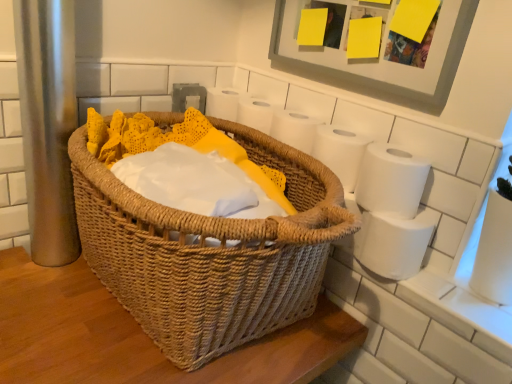
Question: From a real-world perspective, does white matte toilet paper at right, placed as the first toilet paper when sorted from bottom to top, sit lower than white matte toilet paper at upper right, acting as the third toilet paper starting from the bottom?

Choices:
 (A) yes
 (B) no

Answer: (A)

Question: Considering the relative sizes of white matte toilet paper at right, placed as the first toilet paper when sorted from bottom to top, and white matte toilet paper at upper right, acting as the third toilet paper starting from the bottom, in the image provided, is white matte toilet paper at right, placed as the first toilet paper when sorted from bottom to top, wider than white matte toilet paper at upper right, acting as the third toilet paper starting from the bottom,?

Choices:
 (A) no
 (B) yes

Answer: (B)

Question: Can you confirm if white matte toilet paper at right, which is counted as the third toilet paper, starting from the top, is positioned to the left of white matte toilet paper at upper right, arranged as the first toilet paper when viewed from the top?

Choices:
 (A) no
 (B) yes

Answer: (A)

Question: Are white matte toilet paper at right, which is counted as the third toilet paper, starting from the top, and white matte toilet paper at upper right, acting as the third toilet paper starting from the bottom, far apart?

Choices:
 (A) no
 (B) yes

Answer: (A)

Question: Is white matte toilet paper at right, which is counted as the third toilet paper, starting from the top, looking in the opposite direction of white matte toilet paper at upper right, acting as the third toilet paper starting from the bottom?

Choices:
 (A) yes
 (B) no

Answer: (B)

Question: Is white matte toilet paper at right, which is counted as the third toilet paper, starting from the top, in contact with white matte toilet paper at upper right, acting as the third toilet paper starting from the bottom?

Choices:
 (A) yes
 (B) no

Answer: (B)

Question: Is matte gray picture frame at upper right not inside white matte toilet paper at upper right, arranged as the first toilet paper when viewed from the top?

Choices:
 (A) no
 (B) yes

Answer: (B)

Question: From the image's perspective, would you say matte gray picture frame at upper right is shown under white matte toilet paper at upper right, arranged as the first toilet paper when viewed from the top?

Choices:
 (A) no
 (B) yes

Answer: (A)

Question: Is the position of matte gray picture frame at upper right less distant than that of white matte toilet paper at upper right, arranged as the first toilet paper when viewed from the top?

Choices:
 (A) yes
 (B) no

Answer: (A)

Question: Is matte gray picture frame at upper right far from white matte toilet paper at upper right, arranged as the first toilet paper when viewed from the top?

Choices:
 (A) yes
 (B) no

Answer: (B)

Question: From a real-world perspective, is matte gray picture frame at upper right over white matte toilet paper at upper right, acting as the third toilet paper starting from the bottom?

Choices:
 (A) no
 (B) yes

Answer: (B)

Question: Is matte gray picture frame at upper right to the left of white matte toilet paper at upper right, arranged as the first toilet paper when viewed from the top, from the viewer's perspective?

Choices:
 (A) no
 (B) yes

Answer: (A)

Question: Can you confirm if woven brown picnic basket at center is positioned to the left of white matte toilet paper at right, placed as the first toilet paper when sorted from bottom to top?

Choices:
 (A) yes
 (B) no

Answer: (A)